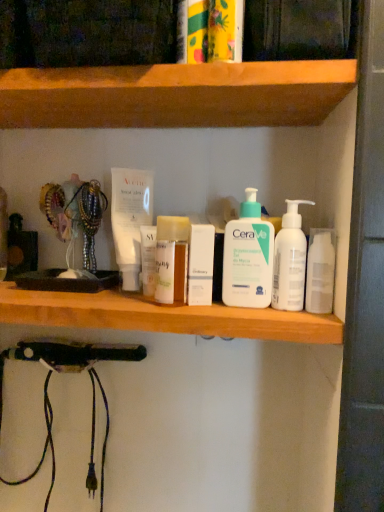
The height and width of the screenshot is (512, 384). What are the coordinates of `vacant space to the left of white pump bottle at center, which is counted as the 2th cleaning product, starting from the left` in the screenshot? It's located at (181, 305).